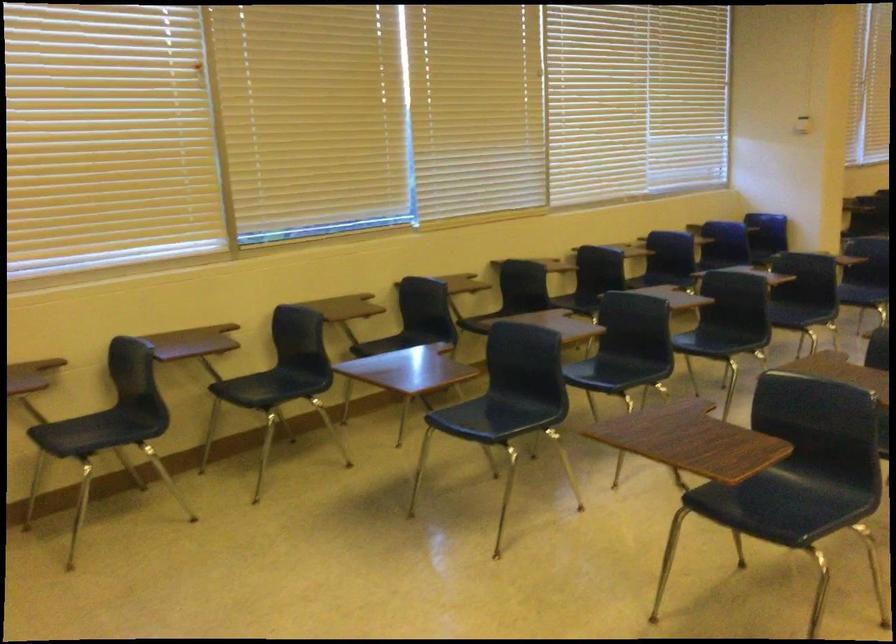
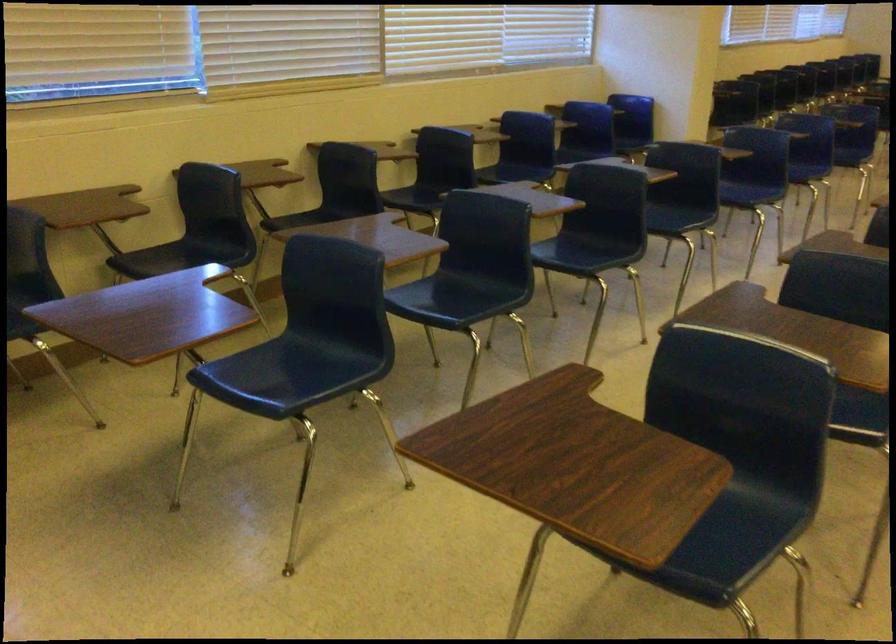
Where in the second image is the point corresponding to the point at 487,415 from the first image?

(283, 375)